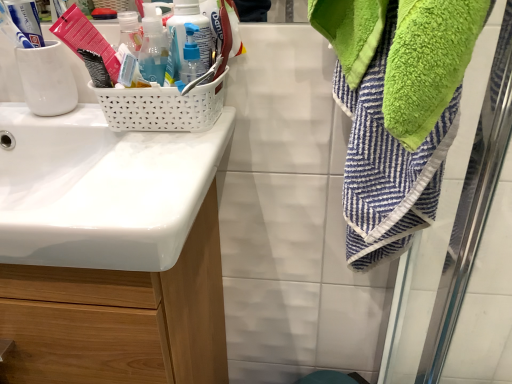
Describe the element at coordinates (195, 33) in the screenshot. This screenshot has height=384, width=512. I see `translucent plastic pump bottle at upper center, acting as the second bottle starting from the left` at that location.

What is the approximate height of translucent plastic pump bottle at upper center, positioned as the 2th bottle in right-to-left order?

translucent plastic pump bottle at upper center, positioned as the 2th bottle in right-to-left order, is 6.05 inches tall.

Measure the distance between translucent plastic pump bottle at center, placed as the 3th bottle when sorted from left to right, and camera.

translucent plastic pump bottle at center, placed as the 3th bottle when sorted from left to right, and camera are 22.95 inches apart.

The height and width of the screenshot is (384, 512). Identify the location of translucent plastic soap dispenser at upper left, which is counted as the 1th bottle, starting from the left. (152, 46).

Locate an element on the screen. The width and height of the screenshot is (512, 384). translucent plastic pump bottle at upper center, positioned as the 2th bottle in right-to-left order is located at coordinates (195, 33).

Find the location of a particular element. This screenshot has width=512, height=384. bottle that is the 2nd one above the translucent plastic pump bottle at center, placed as the 3th bottle when sorted from left to right (from a real-world perspective) is located at coordinates (195, 33).

In the image, is translucent plastic pump bottle at upper center, positioned as the 2th bottle in right-to-left order, positioned in front of or behind translucent plastic pump bottle at center, placed as the 3th bottle when sorted from left to right?

Clearly, translucent plastic pump bottle at upper center, positioned as the 2th bottle in right-to-left order, is behind translucent plastic pump bottle at center, placed as the 3th bottle when sorted from left to right.

Based on the photo, is translucent plastic pump bottle at upper center, acting as the second bottle starting from the left, directly adjacent to translucent plastic pump bottle at center, placed as the 3th bottle when sorted from left to right?

Yes.

Considering the sizes of objects translucent plastic pump bottle at upper center, positioned as the 2th bottle in right-to-left order, and translucent plastic pump bottle at center, placed as the 3th bottle when sorted from left to right, in the image provided, who is taller, translucent plastic pump bottle at upper center, positioned as the 2th bottle in right-to-left order, or translucent plastic pump bottle at center, placed as the 3th bottle when sorted from left to right,?

With more height is translucent plastic pump bottle at upper center, positioned as the 2th bottle in right-to-left order.

Is translucent plastic soap dispenser at upper left, which is counted as the 1th bottle, starting from the left, touching white glossy sink at left?

translucent plastic soap dispenser at upper left, which is counted as the 1th bottle, starting from the left, and white glossy sink at left are not in contact.

From the image's perspective, is translucent plastic soap dispenser at upper left, which ranks as the 3th bottle in right-to-left order, above or below white glossy sink at left?

translucent plastic soap dispenser at upper left, which ranks as the 3th bottle in right-to-left order, is above white glossy sink at left.

Is translucent plastic soap dispenser at upper left, which ranks as the 3th bottle in right-to-left order, wider than white glossy sink at left?

Incorrect, the width of translucent plastic soap dispenser at upper left, which ranks as the 3th bottle in right-to-left order, does not surpass that of white glossy sink at left.

Does point (155, 70) appear closer or farther from the camera than point (188, 195)?

Point (155, 70) is positioned farther from the camera compared to point (188, 195).

Choose the correct answer: Is translucent plastic soap dispenser at upper left, which is counted as the 1th bottle, starting from the left, inside translucent plastic pump bottle at upper center, acting as the second bottle starting from the left, or outside it?

translucent plastic soap dispenser at upper left, which is counted as the 1th bottle, starting from the left, is spatially situated outside translucent plastic pump bottle at upper center, acting as the second bottle starting from the left.

Looking at this image, is translucent plastic soap dispenser at upper left, which is counted as the 1th bottle, starting from the left, aimed at translucent plastic pump bottle at upper center, acting as the second bottle starting from the left?

No.

Which of these two, translucent plastic soap dispenser at upper left, which is counted as the 1th bottle, starting from the left, or translucent plastic pump bottle at upper center, acting as the second bottle starting from the left, is thinner?

With smaller width is translucent plastic pump bottle at upper center, acting as the second bottle starting from the left.

From the image's perspective, is white glossy sink at left on translucent plastic pump bottle at center, arranged as the 1th bottle when viewed from the right?

Actually, white glossy sink at left appears below translucent plastic pump bottle at center, arranged as the 1th bottle when viewed from the right, in the image.

Can we say white glossy sink at left lies outside translucent plastic pump bottle at center, placed as the 3th bottle when sorted from left to right?

Absolutely, white glossy sink at left is external to translucent plastic pump bottle at center, placed as the 3th bottle when sorted from left to right.

Does white glossy sink at left have a greater height compared to translucent plastic pump bottle at center, arranged as the 1th bottle when viewed from the right?

Yes, white glossy sink at left is taller than translucent plastic pump bottle at center, arranged as the 1th bottle when viewed from the right.

Considering the positions of objects translucent plastic soap dispenser at upper left, which ranks as the 3th bottle in right-to-left order, and translucent plastic pump bottle at center, arranged as the 1th bottle when viewed from the right, in the image provided, who is more to the right, translucent plastic soap dispenser at upper left, which ranks as the 3th bottle in right-to-left order, or translucent plastic pump bottle at center, arranged as the 1th bottle when viewed from the right,?

translucent plastic pump bottle at center, arranged as the 1th bottle when viewed from the right.

Who is smaller, translucent plastic soap dispenser at upper left, which ranks as the 3th bottle in right-to-left order, or translucent plastic pump bottle at center, arranged as the 1th bottle when viewed from the right?

With smaller size is translucent plastic pump bottle at center, arranged as the 1th bottle when viewed from the right.

Which object is more forward, translucent plastic soap dispenser at upper left, which is counted as the 1th bottle, starting from the left, or translucent plastic pump bottle at center, placed as the 3th bottle when sorted from left to right?

translucent plastic soap dispenser at upper left, which is counted as the 1th bottle, starting from the left, is more forward.

From a real-world perspective, is translucent plastic soap dispenser at upper left, which is counted as the 1th bottle, starting from the left, positioned above or below translucent plastic pump bottle at center, placed as the 3th bottle when sorted from left to right?

translucent plastic soap dispenser at upper left, which is counted as the 1th bottle, starting from the left, is situated higher than translucent plastic pump bottle at center, placed as the 3th bottle when sorted from left to right, in the real world.

How far apart are translucent plastic pump bottle at center, arranged as the 1th bottle when viewed from the right, and white glossy sink at left?

translucent plastic pump bottle at center, arranged as the 1th bottle when viewed from the right, and white glossy sink at left are 8.45 inches apart from each other.

Is translucent plastic pump bottle at center, placed as the 3th bottle when sorted from left to right, inside or outside of white glossy sink at left?

translucent plastic pump bottle at center, placed as the 3th bottle when sorted from left to right, cannot be found inside white glossy sink at left.

From the image's perspective, which object appears higher, translucent plastic pump bottle at center, placed as the 3th bottle when sorted from left to right, or white glossy sink at left?

translucent plastic pump bottle at center, placed as the 3th bottle when sorted from left to right.

Considering the positions of points (101, 244) and (212, 43), is point (101, 244) closer to camera compared to point (212, 43)?

Yes, point (101, 244) is in front of point (212, 43).

From the image's perspective, which one is positioned lower, white glossy sink at left or translucent plastic pump bottle at upper center, positioned as the 2th bottle in right-to-left order?

white glossy sink at left, from the image's perspective.

Is white glossy sink at left placed right next to translucent plastic pump bottle at upper center, positioned as the 2th bottle in right-to-left order?

No, white glossy sink at left is not in contact with translucent plastic pump bottle at upper center, positioned as the 2th bottle in right-to-left order.

The width and height of the screenshot is (512, 384). Identify the location of the 3rd bottle behind the white glossy sink at left. (195, 33).

At what (x,y) coordinates should I click in order to perform the action: click on bottle behind the translucent plastic pump bottle at center, placed as the 3th bottle when sorted from left to right. Please return your answer as a coordinate pair (x, y). Looking at the image, I should click on (195, 33).

What are the coordinates of `sink below the translucent plastic soap dispenser at upper left, which is counted as the 1th bottle, starting from the left (from the image's perspective)` in the screenshot? It's located at (101, 190).

Considering their positions, is white glossy sink at left positioned further to translucent plastic pump bottle at upper center, acting as the second bottle starting from the left, than translucent plastic soap dispenser at upper left, which ranks as the 3th bottle in right-to-left order?

white glossy sink at left lies further to translucent plastic pump bottle at upper center, acting as the second bottle starting from the left, than the other object.

Looking at the image, which one is located closer to translucent plastic soap dispenser at upper left, which is counted as the 1th bottle, starting from the left, translucent plastic pump bottle at center, placed as the 3th bottle when sorted from left to right, or white glossy sink at left?

translucent plastic pump bottle at center, placed as the 3th bottle when sorted from left to right, lies closer to translucent plastic soap dispenser at upper left, which is counted as the 1th bottle, starting from the left, than the other object.

Considering their positions, is translucent plastic pump bottle at center, placed as the 3th bottle when sorted from left to right, positioned closer to white glossy sink at left than translucent plastic pump bottle at upper center, positioned as the 2th bottle in right-to-left order?

The object closer to white glossy sink at left is translucent plastic pump bottle at center, placed as the 3th bottle when sorted from left to right.

Which object lies nearer to the anchor point translucent plastic soap dispenser at upper left, which is counted as the 1th bottle, starting from the left, white glossy sink at left or translucent plastic pump bottle at upper center, acting as the second bottle starting from the left?

The object closer to translucent plastic soap dispenser at upper left, which is counted as the 1th bottle, starting from the left, is translucent plastic pump bottle at upper center, acting as the second bottle starting from the left.

Looking at this image, considering their positions, is translucent plastic pump bottle at center, arranged as the 1th bottle when viewed from the right, positioned further to translucent plastic pump bottle at upper center, positioned as the 2th bottle in right-to-left order, than translucent plastic soap dispenser at upper left, which ranks as the 3th bottle in right-to-left order?

translucent plastic soap dispenser at upper left, which ranks as the 3th bottle in right-to-left order, is further to translucent plastic pump bottle at upper center, positioned as the 2th bottle in right-to-left order.

In the scene shown: Considering their positions, is translucent plastic pump bottle at upper center, acting as the second bottle starting from the left, positioned further to translucent plastic pump bottle at center, arranged as the 1th bottle when viewed from the right, than translucent plastic soap dispenser at upper left, which is counted as the 1th bottle, starting from the left?

translucent plastic soap dispenser at upper left, which is counted as the 1th bottle, starting from the left.

Based on their spatial positions, is translucent plastic soap dispenser at upper left, which is counted as the 1th bottle, starting from the left, or translucent plastic pump bottle at upper center, acting as the second bottle starting from the left, closer to translucent plastic pump bottle at center, arranged as the 1th bottle when viewed from the right?

translucent plastic pump bottle at upper center, acting as the second bottle starting from the left.

Looking at the image, which one is located further to translucent plastic pump bottle at upper center, acting as the second bottle starting from the left, translucent plastic soap dispenser at upper left, which ranks as the 3th bottle in right-to-left order, or translucent plastic pump bottle at center, arranged as the 1th bottle when viewed from the right?

translucent plastic soap dispenser at upper left, which ranks as the 3th bottle in right-to-left order, lies further to translucent plastic pump bottle at upper center, acting as the second bottle starting from the left, than the other object.

At what (x,y) coordinates should I click in order to perform the action: click on bottle that lies between translucent plastic pump bottle at upper center, positioned as the 2th bottle in right-to-left order, and translucent plastic pump bottle at center, arranged as the 1th bottle when viewed from the right, from top to bottom. Please return your answer as a coordinate pair (x, y). Image resolution: width=512 pixels, height=384 pixels. Looking at the image, I should click on (152, 46).

The height and width of the screenshot is (384, 512). Identify the location of bottle between translucent plastic soap dispenser at upper left, which is counted as the 1th bottle, starting from the left, and white glossy sink at left vertically. (191, 56).